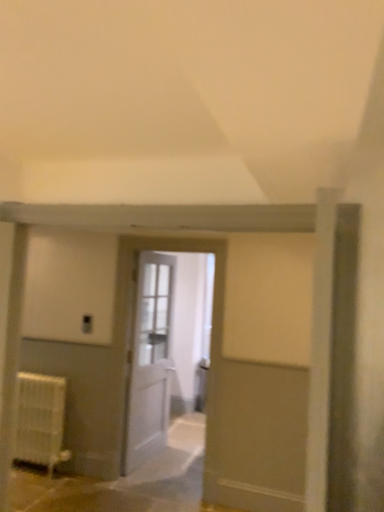
Question: Is white wooden door at center, acting as the 2th door starting from the front, at the right side of white matte radiator at lower left?

Choices:
 (A) no
 (B) yes

Answer: (B)

Question: Is white wooden door at center, which is the 1th door in back-to-front order, looking in the opposite direction of white matte radiator at lower left?

Choices:
 (A) no
 (B) yes

Answer: (A)

Question: Is white wooden door at center, acting as the 2th door starting from the front, positioned far away from white matte radiator at lower left?

Choices:
 (A) no
 (B) yes

Answer: (A)

Question: Considering the relative sizes of white wooden door at center, acting as the 2th door starting from the front, and white matte radiator at lower left in the image provided, is white wooden door at center, acting as the 2th door starting from the front, shorter than white matte radiator at lower left?

Choices:
 (A) yes
 (B) no

Answer: (B)

Question: Is the depth of white wooden door at center, which is the 1th door in back-to-front order, less than that of white matte radiator at lower left?

Choices:
 (A) yes
 (B) no

Answer: (B)

Question: From a real-world perspective, is white wooden door at center, which is the 1th door in back-to-front order, below white matte radiator at lower left?

Choices:
 (A) yes
 (B) no

Answer: (B)

Question: Is white wooden door at center, acting as the 2th door starting from the front, at the back of white wooden door at center, which is counted as the 2th door, starting from the back?

Choices:
 (A) yes
 (B) no

Answer: (A)

Question: Is white wooden door at center, which is counted as the 2th door, starting from the back, to the right of white wooden door at center, which is the 1th door in back-to-front order, from the viewer's perspective?

Choices:
 (A) yes
 (B) no

Answer: (A)

Question: Is white wooden door at center, which ranks as the first door in front-to-back order, located outside white wooden door at center, acting as the 2th door starting from the front?

Choices:
 (A) yes
 (B) no

Answer: (A)

Question: Does white wooden door at center, which is counted as the 2th door, starting from the back, lie in front of white wooden door at center, acting as the 2th door starting from the front?

Choices:
 (A) yes
 (B) no

Answer: (A)

Question: Is white wooden door at center, which ranks as the first door in front-to-back order, bigger than white wooden door at center, which is the 1th door in back-to-front order?

Choices:
 (A) no
 (B) yes

Answer: (A)

Question: Considering the relative sizes of white wooden door at center, which is counted as the 2th door, starting from the back, and white wooden door at center, acting as the 2th door starting from the front, in the image provided, is white wooden door at center, which is counted as the 2th door, starting from the back, smaller than white wooden door at center, acting as the 2th door starting from the front,?

Choices:
 (A) yes
 (B) no

Answer: (A)

Question: Is white matte radiator at lower left shorter than white wooden door at center, which is the 1th door in back-to-front order?

Choices:
 (A) yes
 (B) no

Answer: (A)